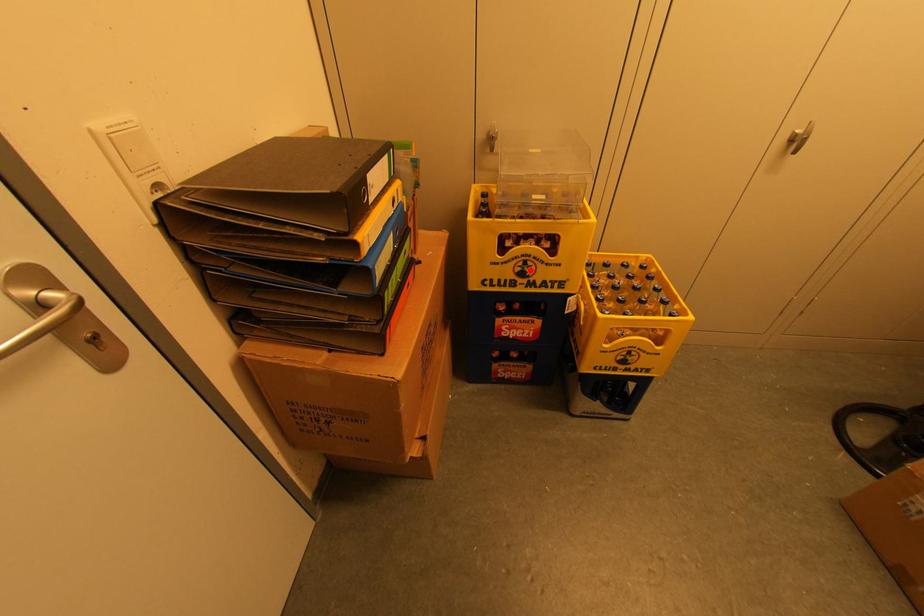
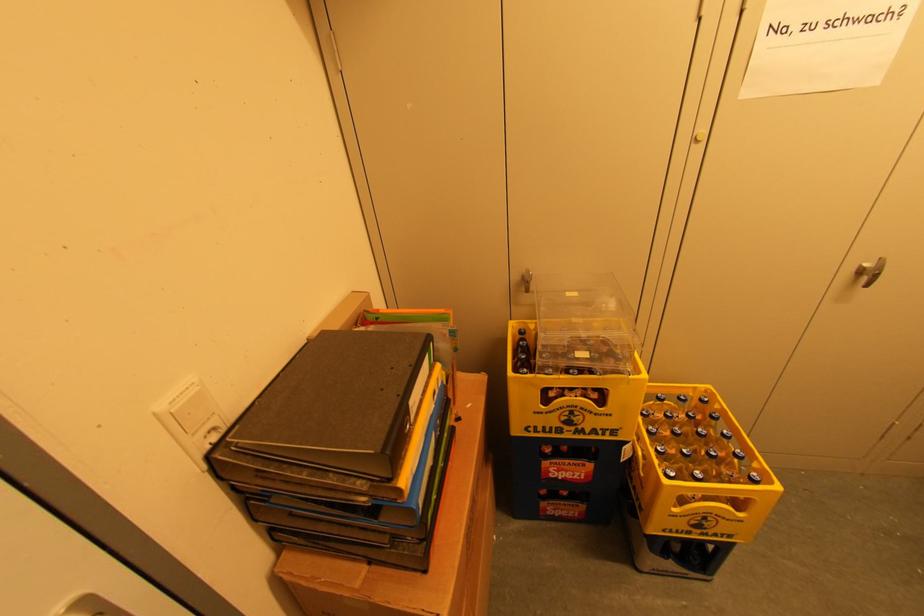
Where in the second image is the point corresponding to the highlighted location from the first image?

(578, 419)